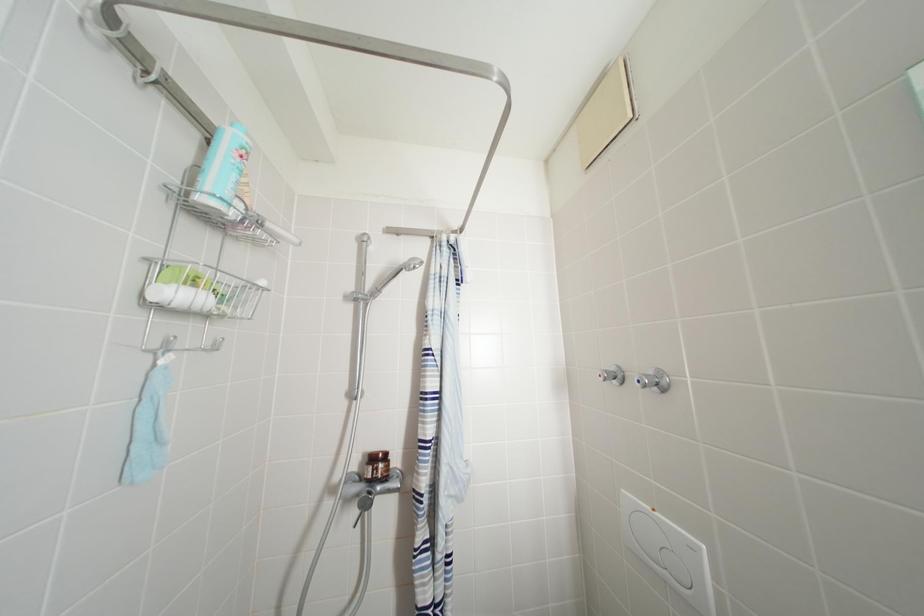
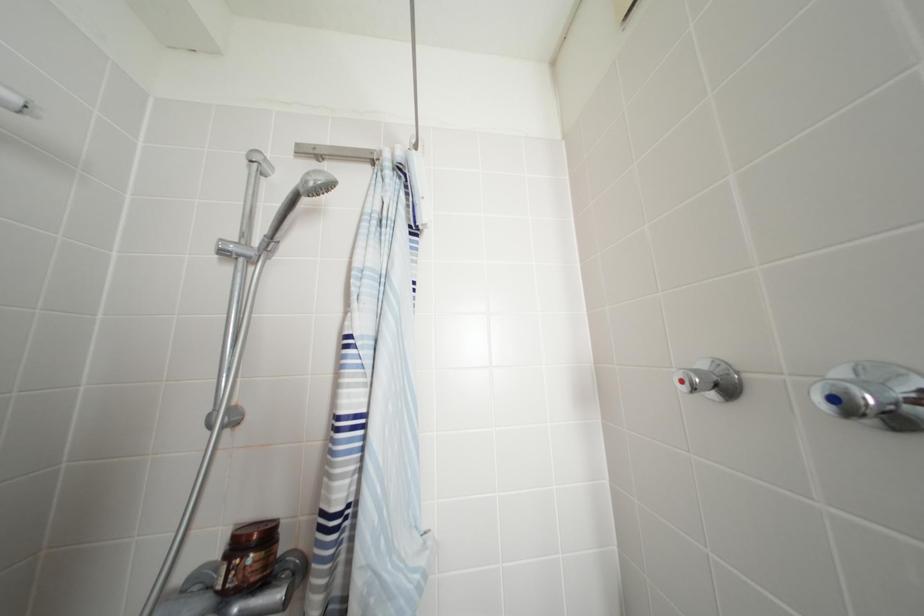
Question: The camera is either moving clockwise (left) or counter-clockwise (right) around the object. The first image is from the beginning of the video and the second image is from the end. Is the camera moving left or right when shooting the video?

Choices:
 (A) Left
 (B) Right

Answer: (B)